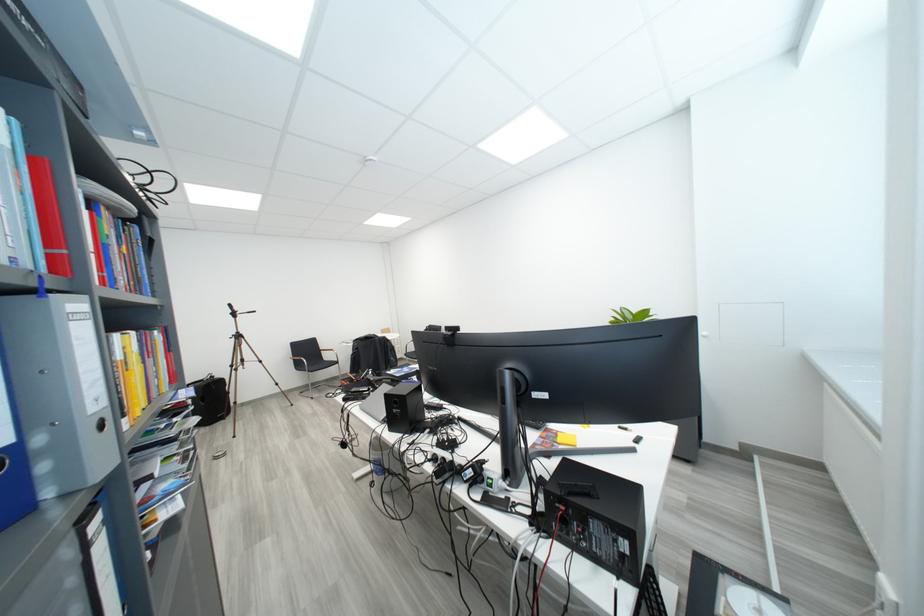
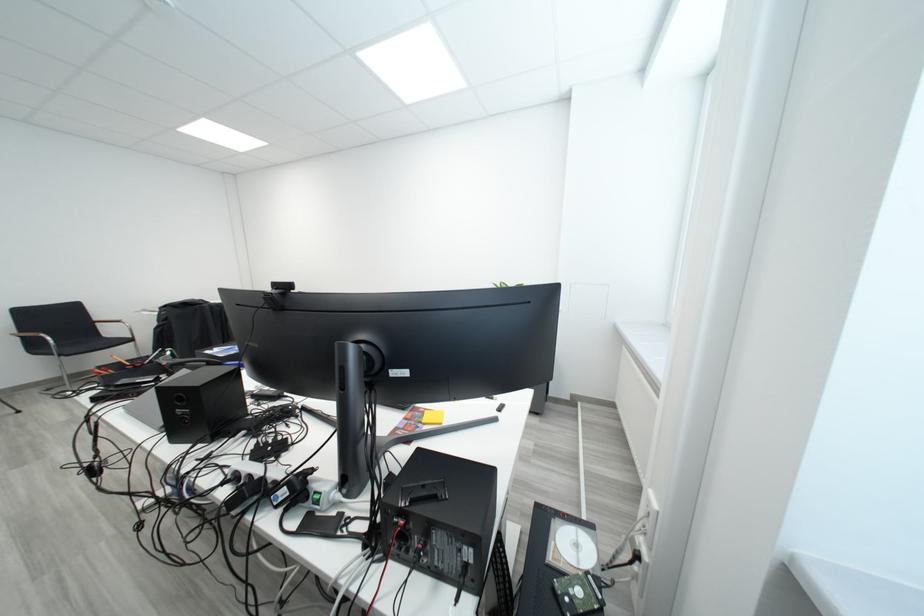
The point at (565, 437) is marked in the first image. Where is the corresponding point in the second image?

(432, 416)